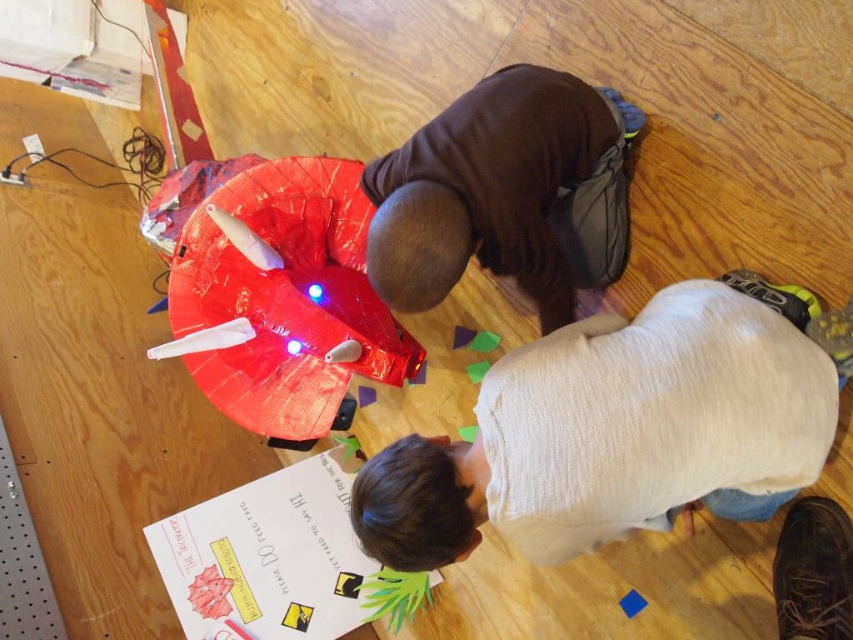
You are trying to decide whether to place a new small plant pot between the light beige sweater at lower center and the shiny plastic toy at center. Since the plant pot is 10 cm tall, will it fit vertically between them?

The light beige sweater at lower center is not as tall as the shiny plastic toy at center, but the exact heights are not provided. However, since the plant pot is only 10 cm tall, it should fit vertically between them as long as there is enough space between their heights. The answer is yes, it can fit.

You are a delivery person who needs to place a small box between the brown matte shirt at center and the shiny plastic toy at center. The box is 12 inches long. Can the box fit between them without overlapping either object?

The distance between the brown matte shirt at center and the shiny plastic toy at center is 12.37 inches. Since the box is 12 inches long, it can fit between them as there is enough space.

You are standing in front of the large circular object and want to reach both the point at coordinates point [606,282] and the point at coordinates point [294,353]. Which point will you need to extend your arm further to touch?

You will need to extend your arm further to touch point [606,282] because it is further away from you compared to point [294,353].